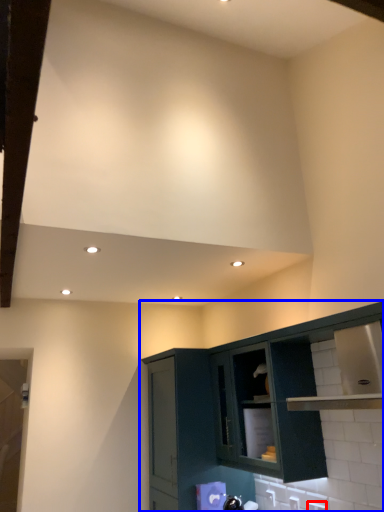
Question: Among these objects, which one is nearest to the camera, electric outlet (highlighted by a red box) or cabinetry (highlighted by a blue box)?

Choices:
 (A) electric outlet
 (B) cabinetry

Answer: (B)